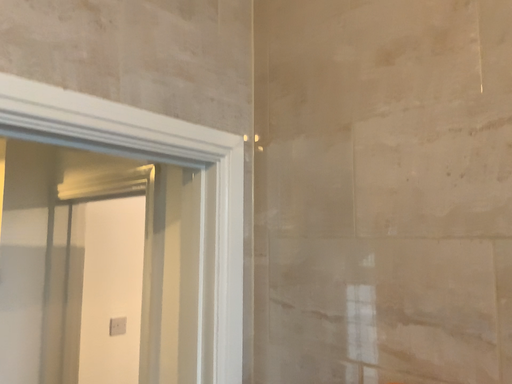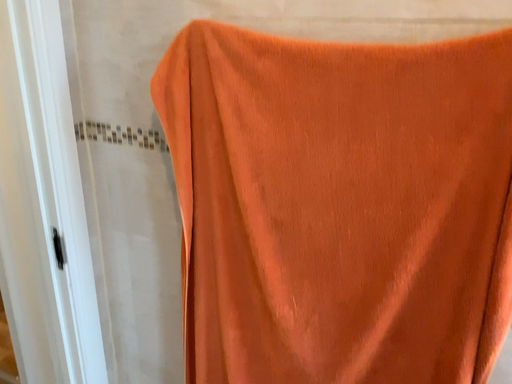
Question: How did the camera likely rotate when shooting the video?

Choices:
 (A) rotated upward
 (B) rotated downward

Answer: (B)